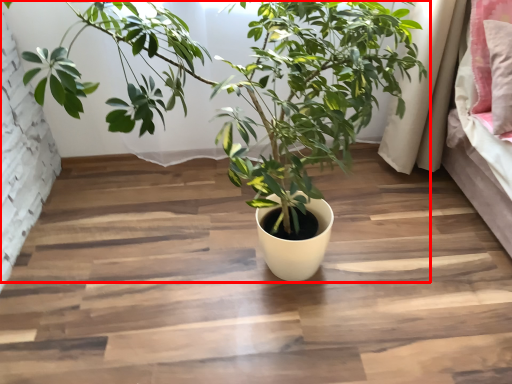
Question: From the image's perspective, what is the correct spatial positioning of houseplant (annotated by the red box) in reference to pillow?

Choices:
 (A) above
 (B) below

Answer: (B)